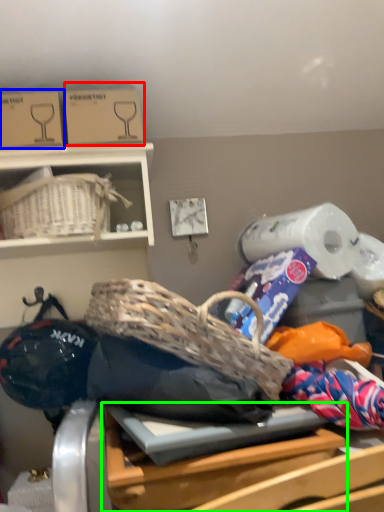
Question: Which object is positioned farthest from cardboard box (highlighted by a red box)? Select from cardboard box (highlighted by a blue box) and table (highlighted by a green box).

Choices:
 (A) cardboard box
 (B) table

Answer: (B)